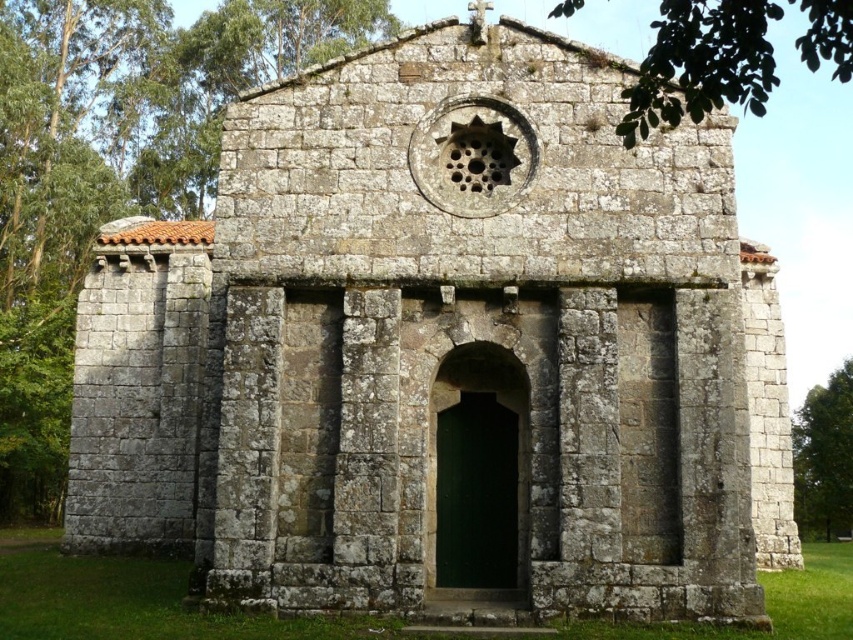
Question: Observing the image, what is the correct spatial positioning of green leafy tree at upper center in reference to green leafy tree at right?

Choices:
 (A) left
 (B) right

Answer: (A)

Question: Which point is closer to the camera?

Choices:
 (A) (836, 376)
 (B) (654, 67)

Answer: (B)

Question: Observing the image, what is the correct spatial positioning of green leafy tree at upper center in reference to green leafy tree at right?

Choices:
 (A) below
 (B) above

Answer: (B)

Question: Does green leafy tree at upper center appear on the left side of green leafy tree at right?

Choices:
 (A) yes
 (B) no

Answer: (A)